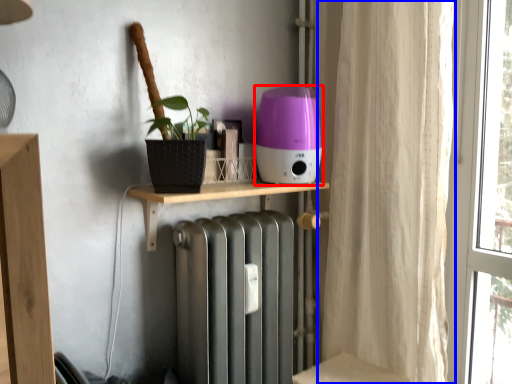
Question: Which of the following is the closest to the observer, appliance (highlighted by a red box) or curtain (highlighted by a blue box)?

Choices:
 (A) appliance
 (B) curtain

Answer: (B)